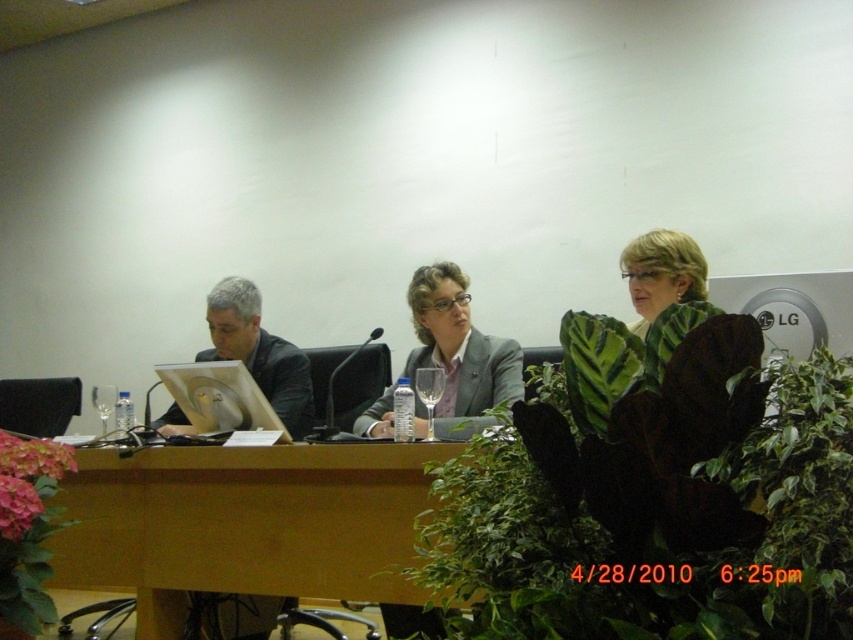
Identify the location of brown wood table at center. Image resolution: width=853 pixels, height=640 pixels. (244, 524).

The height and width of the screenshot is (640, 853). What are the coordinates of `brown wood table at center` in the screenshot? It's located at (244, 524).

Which is behind, point (415, 324) or point (242, 285)?

The point (242, 285) is behind.

Is matte gray suit at center below matte black laptop at left?

Yes, matte gray suit at center is below matte black laptop at left.

Describe the element at coordinates (459, 349) in the screenshot. I see `matte gray suit at center` at that location.

Identify the location of matte gray suit at center. Image resolution: width=853 pixels, height=640 pixels. (459, 349).

Is point (734, 392) behind point (393, 600)?

That is False.

Between point (479, 472) and point (311, 490), which one is positioned in front?

Point (479, 472)

Identify the location of green leafy plant at center. The height and width of the screenshot is (640, 853). tap(654, 506).